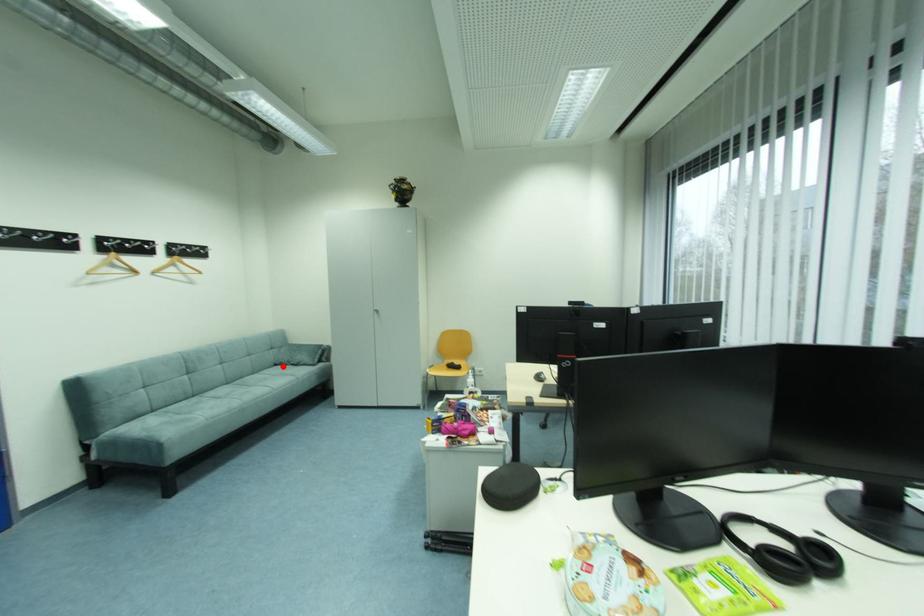
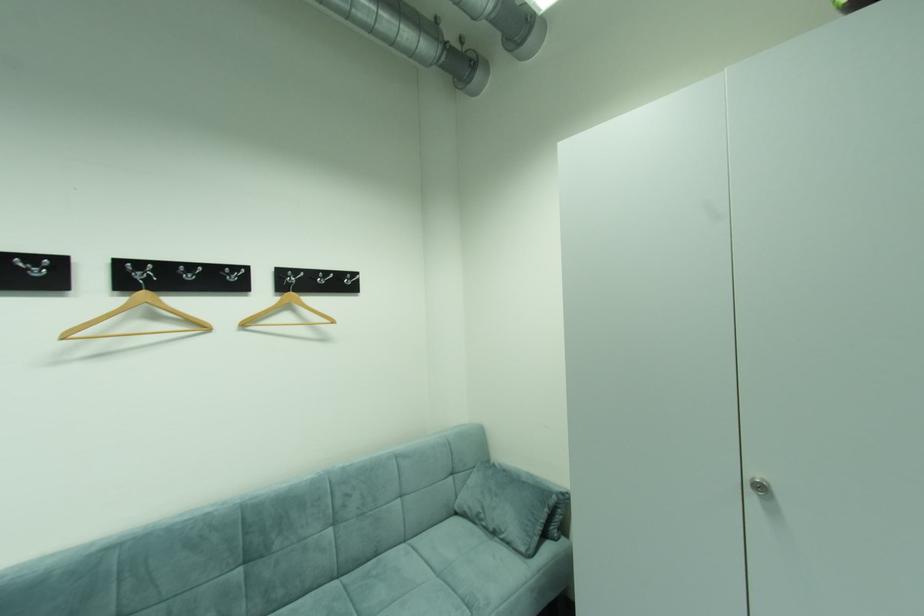
Find the pixel in the second image that matches the highlighted location in the first image.

(464, 514)